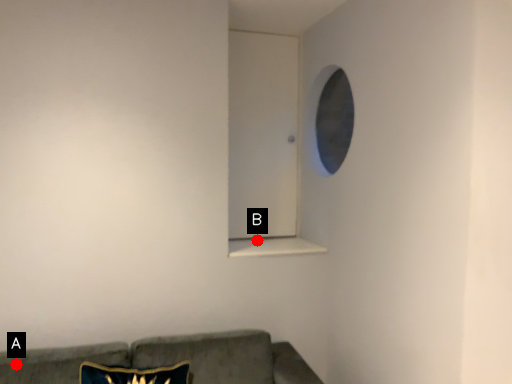
Question: Two points are circled on the image, labeled by A and B beside each circle. Which point appears farthest from the camera in this image?

Choices:
 (A) A is further
 (B) B is further

Answer: (B)